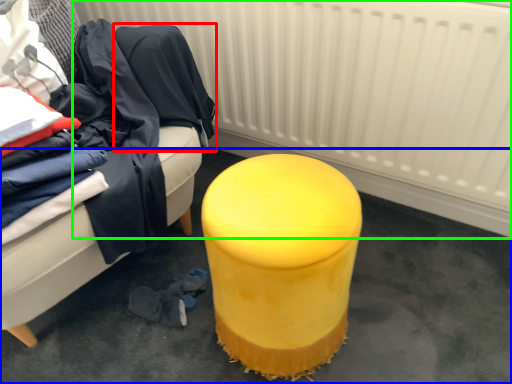
Question: Which object is the closest to the clothing (highlighted by a red box)? Choose among these: concrete (highlighted by a blue box) or radiator (highlighted by a green box).

Choices:
 (A) concrete
 (B) radiator

Answer: (B)